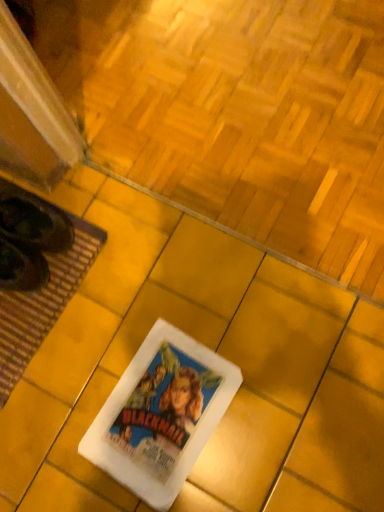
Question: Are white paper at center and white paper movie poster at center located far from each other?

Choices:
 (A) yes
 (B) no

Answer: (B)

Question: Does white paper at center appear on the right side of white paper movie poster at center?

Choices:
 (A) no
 (B) yes

Answer: (B)

Question: Can you confirm if white paper at center is wider than white paper movie poster at center?

Choices:
 (A) no
 (B) yes

Answer: (B)

Question: Is white paper at center located outside white paper movie poster at center?

Choices:
 (A) yes
 (B) no

Answer: (A)

Question: Does white paper at center contain white paper movie poster at center?

Choices:
 (A) no
 (B) yes

Answer: (A)

Question: Based on their sizes in the image, would you say white paper movie poster at center is bigger or smaller than brown woven mat at lower left?

Choices:
 (A) small
 (B) big

Answer: (A)

Question: From a real-world perspective, is white paper movie poster at center above or below brown woven mat at lower left?

Choices:
 (A) above
 (B) below

Answer: (A)

Question: From their relative heights in the image, would you say white paper movie poster at center is taller or shorter than brown woven mat at lower left?

Choices:
 (A) tall
 (B) short

Answer: (B)

Question: From the image's perspective, is white paper movie poster at center above or below brown woven mat at lower left?

Choices:
 (A) above
 (B) below

Answer: (B)

Question: From a real-world perspective, is brown woven mat at lower left above or below white paper at center?

Choices:
 (A) above
 (B) below

Answer: (A)

Question: Do you think brown woven mat at lower left is within white paper at center, or outside of it?

Choices:
 (A) outside
 (B) inside

Answer: (A)

Question: Is brown woven mat at lower left bigger or smaller than white paper at center?

Choices:
 (A) big
 (B) small

Answer: (B)

Question: Would you say brown woven mat at lower left is to the left or to the right of white paper at center in the picture?

Choices:
 (A) left
 (B) right

Answer: (A)

Question: In terms of size, does white paper at center appear bigger or smaller than white paper movie poster at center?

Choices:
 (A) big
 (B) small

Answer: (A)

Question: Do you think white paper at center is within white paper movie poster at center, or outside of it?

Choices:
 (A) outside
 (B) inside

Answer: (A)